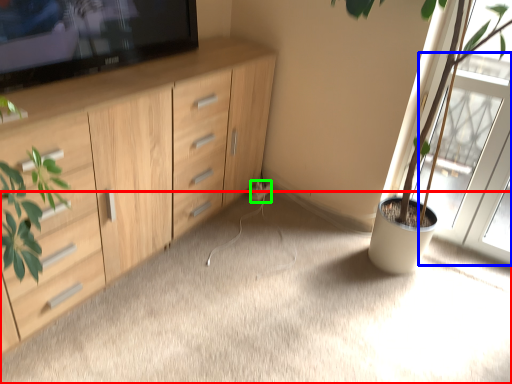
Question: Estimate the real-world distances between objects in this image. Which object is farther from plain (highlighted by a red box), screen door (highlighted by a blue box) or electric outlet (highlighted by a green box)?

Choices:
 (A) screen door
 (B) electric outlet

Answer: (B)